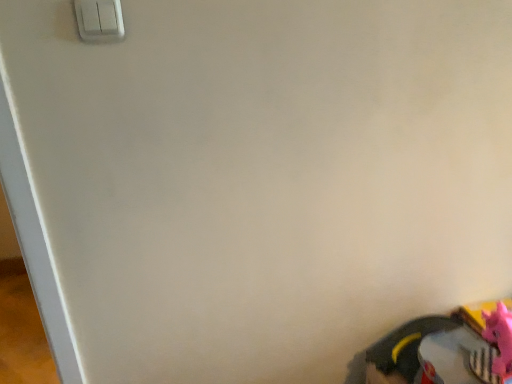
Question: From the image's perspective, is white plastic light switch at upper left below pink rubber toy at lower right?

Choices:
 (A) yes
 (B) no

Answer: (B)

Question: Is white plastic light switch at upper left thinner than pink rubber toy at lower right?

Choices:
 (A) no
 (B) yes

Answer: (B)

Question: Is white plastic light switch at upper left not inside pink rubber toy at lower right?

Choices:
 (A) no
 (B) yes

Answer: (B)

Question: Considering the relative sizes of white plastic light switch at upper left and pink rubber toy at lower right in the image provided, is white plastic light switch at upper left bigger than pink rubber toy at lower right?

Choices:
 (A) no
 (B) yes

Answer: (A)

Question: Is white plastic light switch at upper left to the left of pink rubber toy at lower right from the viewer's perspective?

Choices:
 (A) no
 (B) yes

Answer: (B)

Question: Visually, is white plastic light switch at upper left positioned to the left or to the right of rubberized black shoe at lower right?

Choices:
 (A) right
 (B) left

Answer: (B)

Question: From their relative heights in the image, would you say white plastic light switch at upper left is taller or shorter than rubberized black shoe at lower right?

Choices:
 (A) tall
 (B) short

Answer: (B)

Question: From the image's perspective, is white plastic light switch at upper left positioned above or below rubberized black shoe at lower right?

Choices:
 (A) above
 (B) below

Answer: (A)

Question: Looking at their shapes, would you say white plastic light switch at upper left is wider or thinner than rubberized black shoe at lower right?

Choices:
 (A) thin
 (B) wide

Answer: (A)

Question: Considering their positions, is rubberized black shoe at lower right located in front of or behind white plastic light switch at upper left?

Choices:
 (A) front
 (B) behind

Answer: (B)

Question: From their relative heights in the image, would you say rubberized black shoe at lower right is taller or shorter than white plastic light switch at upper left?

Choices:
 (A) tall
 (B) short

Answer: (A)

Question: Looking at the image, does rubberized black shoe at lower right seem bigger or smaller compared to white plastic light switch at upper left?

Choices:
 (A) big
 (B) small

Answer: (A)

Question: In terms of width, does rubberized black shoe at lower right look wider or thinner when compared to white plastic light switch at upper left?

Choices:
 (A) thin
 (B) wide

Answer: (B)

Question: Is point (370, 347) positioned closer to the camera than point (484, 311)?

Choices:
 (A) closer
 (B) farther

Answer: (B)

Question: Visually, is rubberized black shoe at lower right positioned to the left or to the right of pink rubber toy at lower right?

Choices:
 (A) left
 (B) right

Answer: (A)